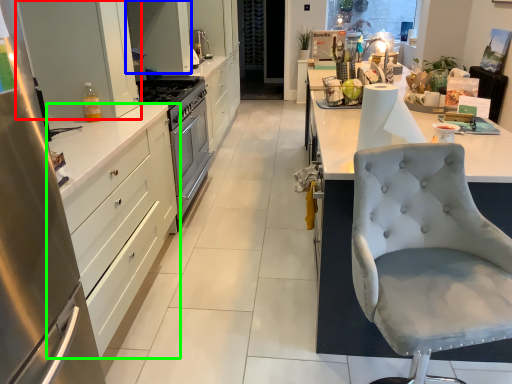
Question: Considering the real-world distances, which object is closest to cabinetry (highlighted by a red box)? cabinetry (highlighted by a blue box) or cabinetry (highlighted by a green box).

Choices:
 (A) cabinetry
 (B) cabinetry

Answer: (B)